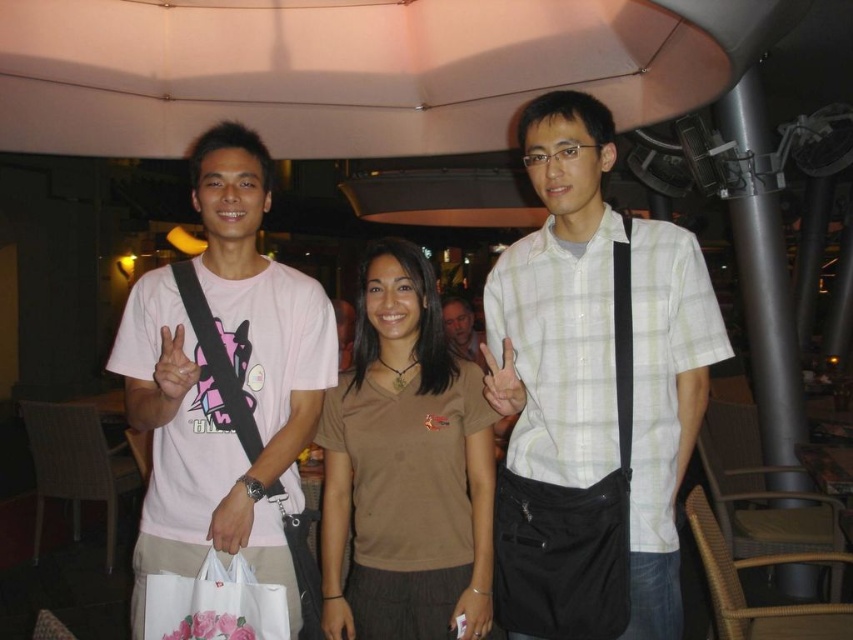
Question: Is the position of brown cotton shirt at center more distant than that of white plastic bag at lower center?

Choices:
 (A) no
 (B) yes

Answer: (B)

Question: Is brown cotton shirt at center to the left of white plastic bag at lower center from the viewer's perspective?

Choices:
 (A) yes
 (B) no

Answer: (B)

Question: Which of the following is the farthest from the observer?

Choices:
 (A) (445, 438)
 (B) (473, 348)
 (C) (648, 611)

Answer: (B)

Question: Which object appears closest to the camera in this image?

Choices:
 (A) white checkered shirt at center
 (B) brown cotton shirt at center
 (C) matte pink t-shirt at left

Answer: (C)

Question: Can you confirm if white checkered shirt at center is positioned to the left of matte pink t-shirt at left?

Choices:
 (A) yes
 (B) no

Answer: (B)

Question: Estimate the real-world distances between objects in this image. Which object is farther from the brown cotton shirt at center?

Choices:
 (A) white checkered shirt at center
 (B) matte brown shirt at center
 (C) matte pink t-shirt at left
 (D) white plastic bag at lower center

Answer: (B)